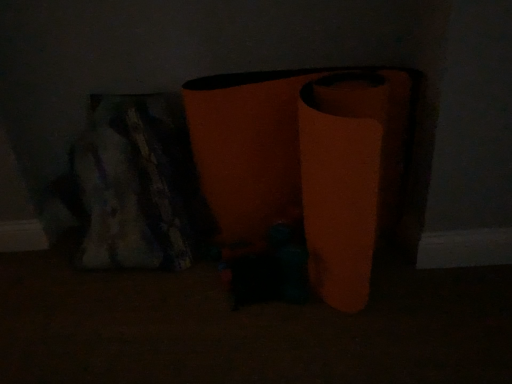
Question: Should I look upward or downward to see orange matte vase at center?

Choices:
 (A) down
 (B) up

Answer: (B)